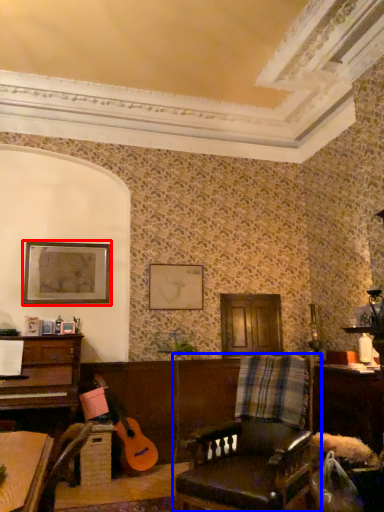
Question: Which object is further to the camera taking this photo, picture frame (highlighted by a red box) or chair (highlighted by a blue box)?

Choices:
 (A) picture frame
 (B) chair

Answer: (A)